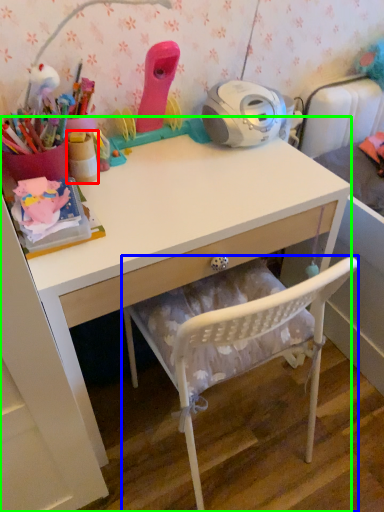
Question: Which object is the farthest from stationery (highlighted by a red box)? Choose among these: chair (highlighted by a blue box) or desk (highlighted by a green box).

Choices:
 (A) chair
 (B) desk

Answer: (A)